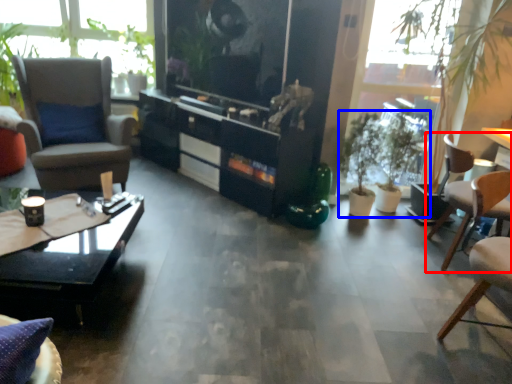
Question: Which point is closer to the camera, chair (highlighted by a red box) or houseplant (highlighted by a blue box)?

Choices:
 (A) chair
 (B) houseplant

Answer: (A)